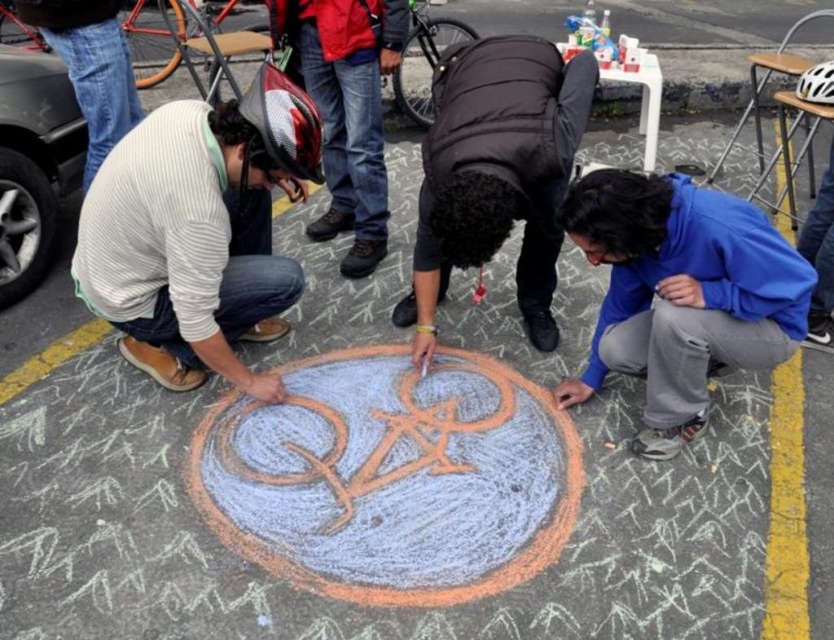
Question: Is blue fleece jacket at lower right wider than dark brown puffy jacket at center?

Choices:
 (A) no
 (B) yes

Answer: (B)

Question: Is striped sweater at left positioned before blue fleece jacket at lower right?

Choices:
 (A) yes
 (B) no

Answer: (B)

Question: Among these objects, which one is nearest to the camera?

Choices:
 (A) blue fleece jacket at lower right
 (B) dark brown puffy jacket at center
 (C) striped sweater at left

Answer: (A)

Question: Considering the relative positions of blue fleece jacket at lower right and dark brown puffy jacket at center in the image provided, where is blue fleece jacket at lower right located with respect to dark brown puffy jacket at center?

Choices:
 (A) left
 (B) right

Answer: (B)

Question: Which is farther from the dark brown puffy jacket at center?

Choices:
 (A) blue fleece jacket at lower right
 (B) striped sweater at left

Answer: (B)

Question: Which object is closer to the camera taking this photo?

Choices:
 (A) blue fleece jacket at lower right
 (B) dark brown puffy jacket at center
 (C) striped sweater at left

Answer: (A)